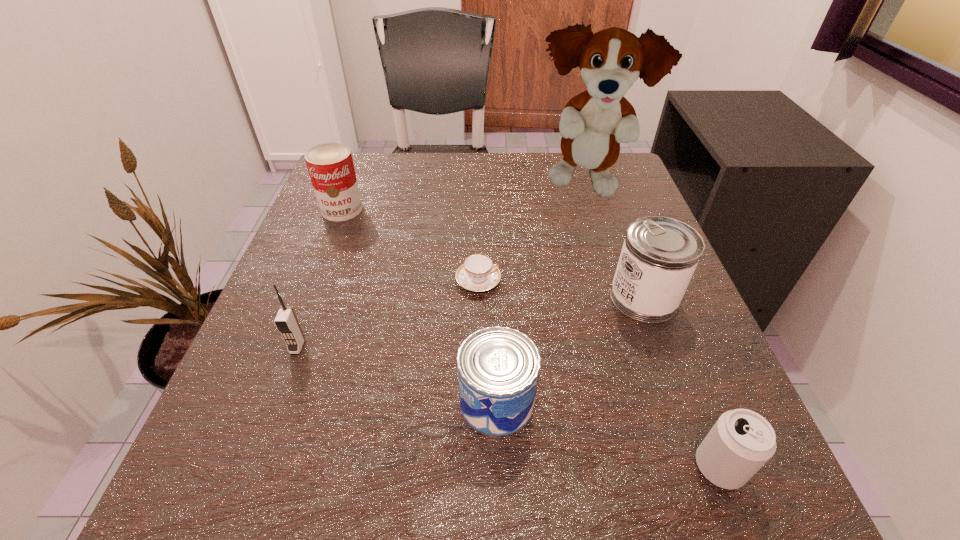
Locate an element on the screen. The height and width of the screenshot is (540, 960). the tallest object is located at coordinates (593, 123).

Locate an element on the screen. The width and height of the screenshot is (960, 540). the farthest can is located at coordinates (330, 165).

At what (x,y) coordinates should I click in order to perform the action: click on the second farthest can. Please return your answer as a coordinate pair (x, y). Looking at the image, I should click on (659, 256).

Where is `the fifth farthest object`? This screenshot has height=540, width=960. the fifth farthest object is located at coordinates (286, 321).

Identify the location of the second nearest can. (498, 367).

Where is `the second nearest object`? This screenshot has width=960, height=540. the second nearest object is located at coordinates (498, 367).

This screenshot has height=540, width=960. I want to click on the nearest object, so click(741, 441).

Where is `teacup`? Image resolution: width=960 pixels, height=540 pixels. teacup is located at coordinates (478, 273).

Where is `vacant space positioned on the face of the puppy`? The height and width of the screenshot is (540, 960). vacant space positioned on the face of the puppy is located at coordinates (610, 267).

Identify the location of vacant space located on the front label of the farthest can. This screenshot has width=960, height=540. (288, 349).